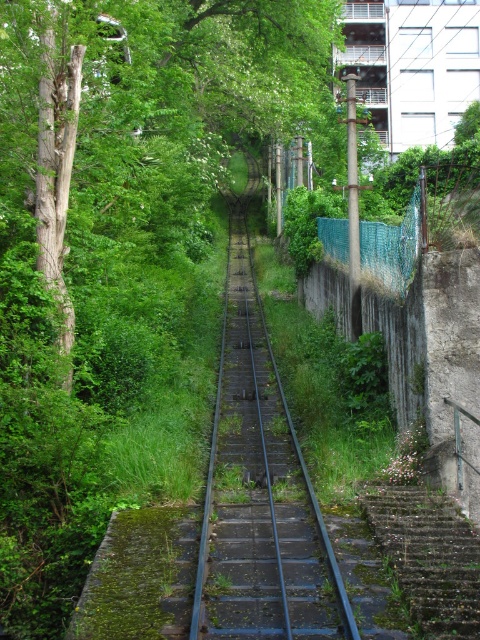
You are standing at the edge of the railway track and want to walk to the point marked as point [196,195]. Given that the railway track is 2 meters wide, can you safely cross it without stepping onto the tracks?

The distance between you and point [196,195] is 27.26 meters. Since the railway track is only 2 meters wide, you can safely cross it by walking around the edges or staying on the vegetation on either side to avoid stepping onto the tracks.

You are a maintenance worker needing to access the rusty metal train track at center for inspection. The mossy concrete stairs at lower right are the only access point. Can you reach the track from the stairs?

The rusty metal train track at center is located above the mossy concrete stairs at lower right, so you can reach the track by climbing the stairs.